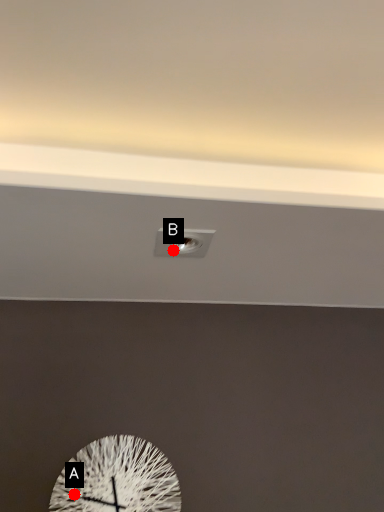
Question: Two points are circled on the image, labeled by A and B beside each circle. Which point is closer to the camera?

Choices:
 (A) A is closer
 (B) B is closer

Answer: (B)